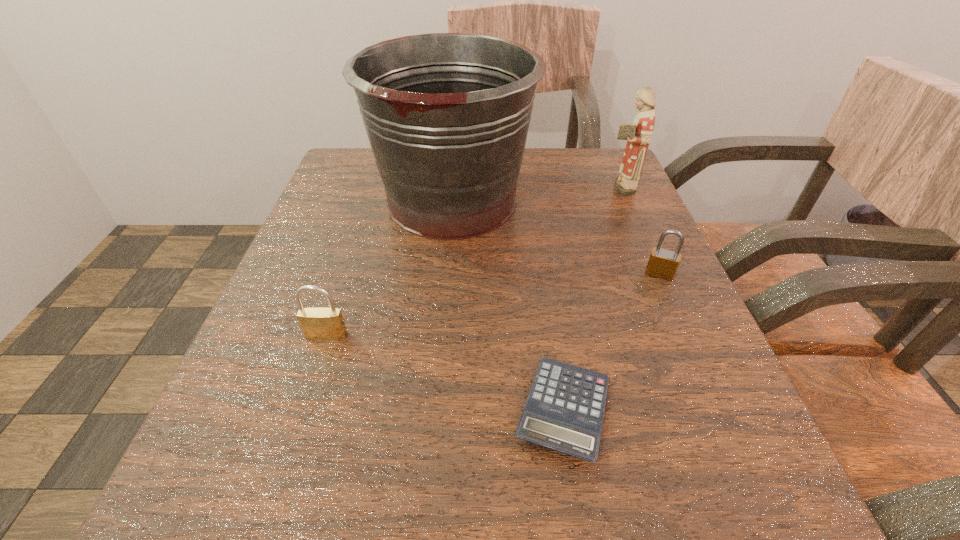
This screenshot has width=960, height=540. I want to click on figurine that is at the right edge, so click(x=639, y=134).

This screenshot has width=960, height=540. What are the coordinates of `padlock present at the right edge` in the screenshot? It's located at pyautogui.click(x=662, y=263).

The height and width of the screenshot is (540, 960). In order to click on calculator that is at the right edge in this screenshot , I will do `click(564, 411)`.

I want to click on object present at the far left corner, so click(447, 115).

What are the coordinates of `object present at the far right corner` in the screenshot? It's located at (639, 134).

Locate an element on the screen. The image size is (960, 540). object located at the near right corner is located at coordinates (564, 411).

In the image, there is a desktop. Where is `vacant space at the far edge`? This screenshot has width=960, height=540. vacant space at the far edge is located at coordinates (519, 174).

The image size is (960, 540). What are the coordinates of `free space at the near edge of the desktop` in the screenshot? It's located at (525, 534).

This screenshot has height=540, width=960. In order to click on vacant point at the left edge in this screenshot , I will do [327, 400].

The height and width of the screenshot is (540, 960). I want to click on vacant space at the right edge, so click(642, 212).